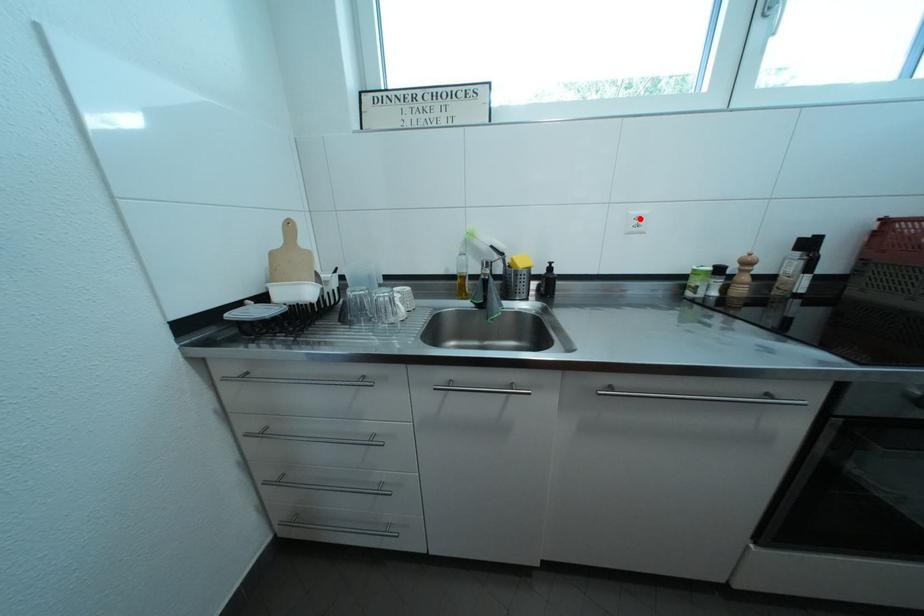
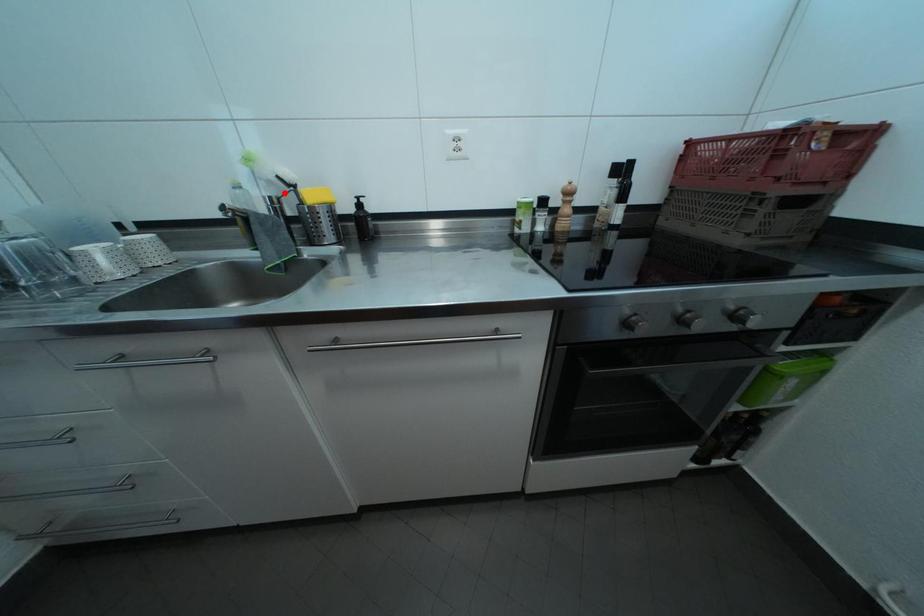
I am providing you with two images of the same scene from different viewpoints. A red point is marked on the first image and another point is marked on the second image. Does the point marked in image1 correspond to the same location as the one in image2?

No